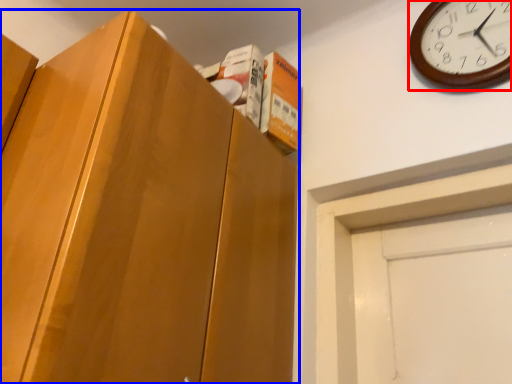
Question: Which object appears closest to the camera in this image, wall clock (highlighted by a red box) or cabinetry (highlighted by a blue box)?

Choices:
 (A) wall clock
 (B) cabinetry

Answer: (B)